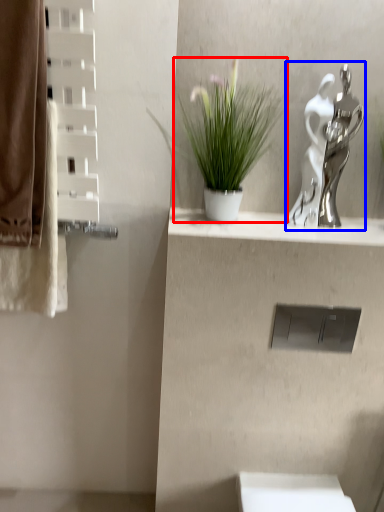
Question: Which of the following is the closest to the observer, houseplant (highlighted by a red box) or sculpture (highlighted by a blue box)?

Choices:
 (A) houseplant
 (B) sculpture

Answer: (A)